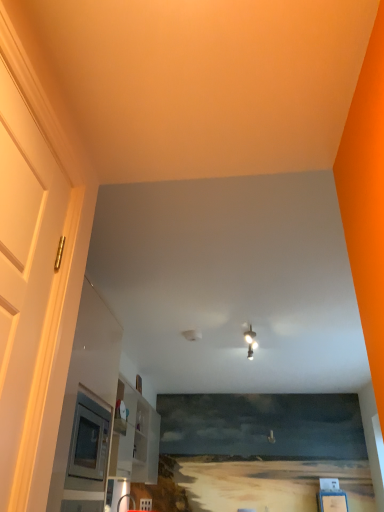
Question: Can you confirm if white glossy door at left is shorter than white glossy light fixture at center?

Choices:
 (A) no
 (B) yes

Answer: (A)

Question: From the image's perspective, is white glossy door at left located above white glossy light fixture at center?

Choices:
 (A) no
 (B) yes

Answer: (B)

Question: Would you say white glossy door at left contains white glossy light fixture at center?

Choices:
 (A) no
 (B) yes

Answer: (A)

Question: Can you confirm if white glossy door at left is positioned to the left of white glossy light fixture at center?

Choices:
 (A) no
 (B) yes

Answer: (B)

Question: Can you confirm if white glossy door at left is taller than white glossy light fixture at center?

Choices:
 (A) no
 (B) yes

Answer: (B)

Question: Is white glossy door at left not near white glossy light fixture at center?

Choices:
 (A) no
 (B) yes

Answer: (B)

Question: From the image's perspective, is white glossy light fixture at center above white glossy door at left?

Choices:
 (A) no
 (B) yes

Answer: (A)

Question: Is white glossy light fixture at center not within white glossy door at left?

Choices:
 (A) no
 (B) yes

Answer: (B)

Question: Is white glossy light fixture at center smaller than white glossy door at left?

Choices:
 (A) no
 (B) yes

Answer: (B)

Question: Does white glossy light fixture at center appear on the left side of white glossy door at left?

Choices:
 (A) no
 (B) yes

Answer: (A)

Question: Are white glossy light fixture at center and white glossy door at left beside each other?

Choices:
 (A) no
 (B) yes

Answer: (A)

Question: Is there a large distance between white glossy light fixture at center and white glossy door at left?

Choices:
 (A) yes
 (B) no

Answer: (A)

Question: Is point (254, 342) positioned closer to the camera than point (0, 504)?

Choices:
 (A) farther
 (B) closer

Answer: (A)